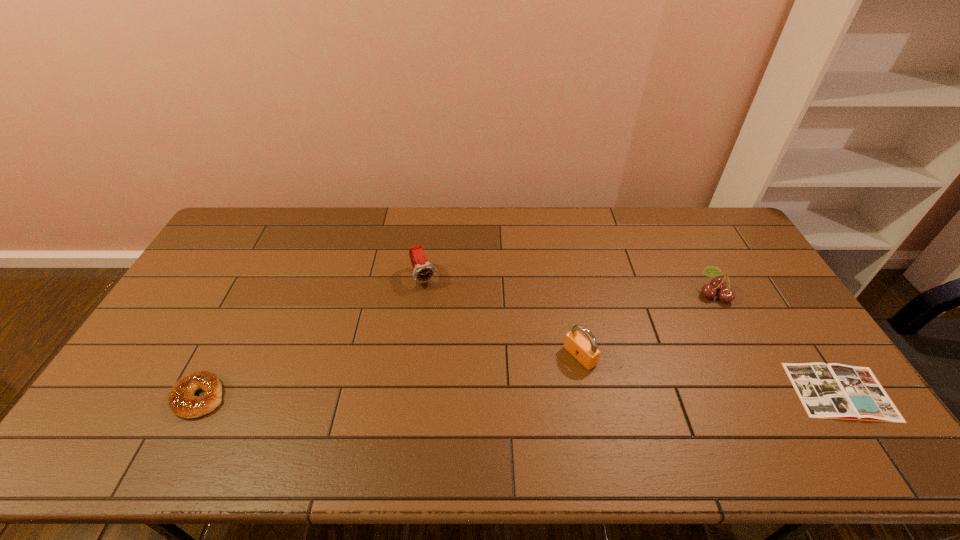
At what (x,y) coordinates should I click in order to perform the action: click on free space between the bagel and the third object from right to left. Please return your answer as a coordinate pair (x, y). Looking at the image, I should click on (390, 376).

Find the location of a particular element. The width and height of the screenshot is (960, 540). empty space that is in between the cherry and the third object from left to right is located at coordinates (646, 326).

Where is `object that stands as the fourth closest to the fourth tallest object`? object that stands as the fourth closest to the fourth tallest object is located at coordinates (830, 391).

Locate an element on the screen. The width and height of the screenshot is (960, 540). object that stands as the closest to the third object from right to left is located at coordinates (718, 284).

Locate an element on the screen. The image size is (960, 540). vacant position in the image that satisfies the following two spatial constraints: 1. on the back side of the watch; 2. on the left side of the fourth tallest object is located at coordinates (261, 278).

Identify the location of free space in the image that satisfies the following two spatial constraints: 1. on the back side of the bagel; 2. on the right side of the third object from right to left. Image resolution: width=960 pixels, height=540 pixels. (221, 356).

The height and width of the screenshot is (540, 960). What are the coordinates of `vacant position in the image that satisfies the following two spatial constraints: 1. on the back side of the second shortest object; 2. on the right side of the rightmost object` in the screenshot? It's located at (203, 392).